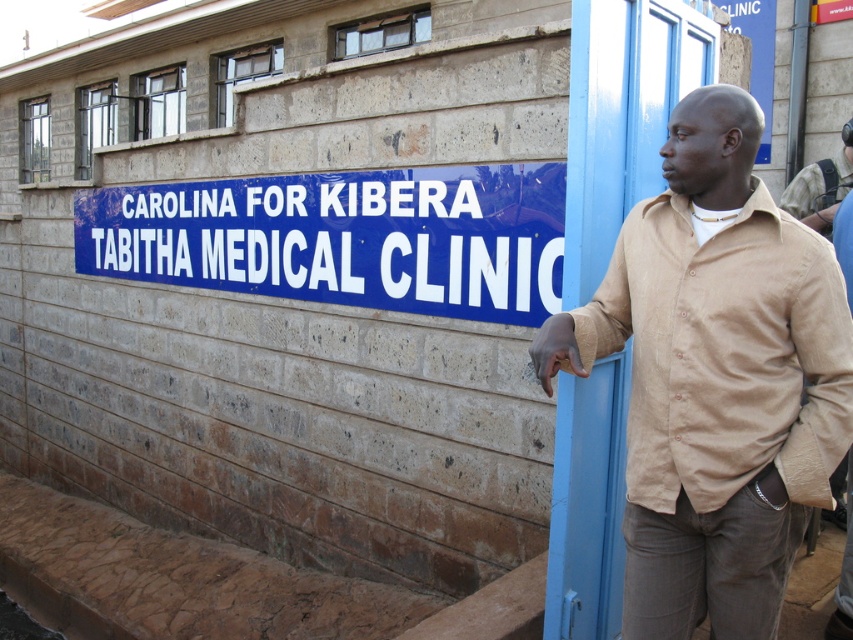
Is point (97, 214) more distant than point (828, 164)?

That is True.

Does point (514, 170) lie in front of point (805, 193)?

Yes, point (514, 170) is in front of point (805, 193).

Between point (450, 308) and point (793, 189), which one is positioned in front?

Point (793, 189) is in front.

You are a GUI agent. You are given a task and a screenshot of the screen. Output one action in this format:
    pyautogui.click(x=<x>, y=<y>)
    Task: Click on the blue plastic sign at center
    
    Given the screenshot: What is the action you would take?
    pyautogui.click(x=345, y=237)

Which is in front, point (793, 301) or point (822, 180)?

Point (793, 301)

Can you confirm if beige cotton shirt at center is bigger than beige cotton shirt at upper right?

Yes, beige cotton shirt at center is bigger than beige cotton shirt at upper right.

This screenshot has height=640, width=853. What are the coordinates of `beige cotton shirt at center` in the screenshot? It's located at (715, 380).

The width and height of the screenshot is (853, 640). In order to click on beige cotton shirt at center in this screenshot , I will do `click(715, 380)`.

Describe the element at coordinates (715, 380) in the screenshot. I see `beige cotton shirt at center` at that location.

Does beige cotton shirt at center have a greater width compared to blue plastic sign at center?

Incorrect, beige cotton shirt at center's width does not surpass blue plastic sign at center's.

Which is in front, point (746, 180) or point (78, 268)?

Point (746, 180) is in front.

Where is `beige cotton shirt at center`? The width and height of the screenshot is (853, 640). beige cotton shirt at center is located at coordinates (715, 380).